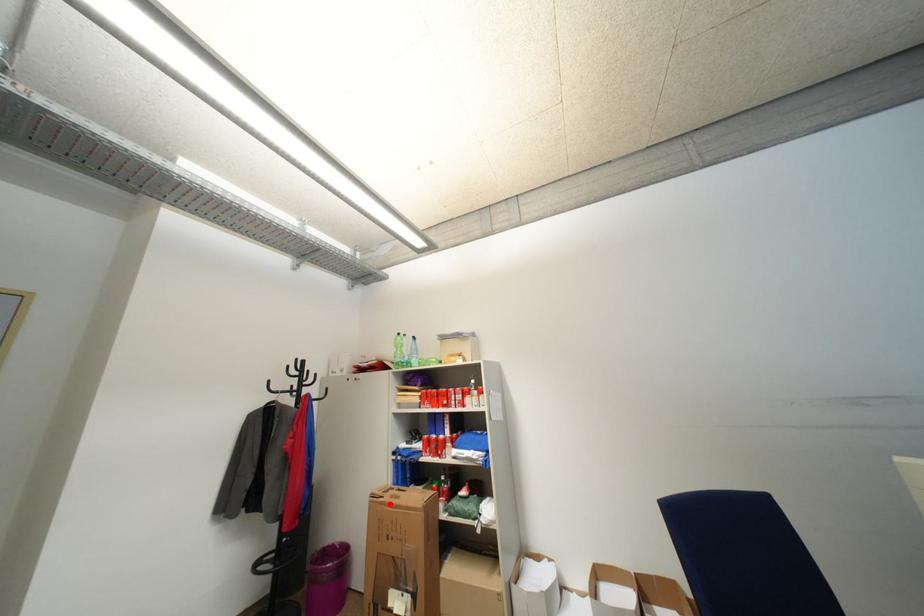
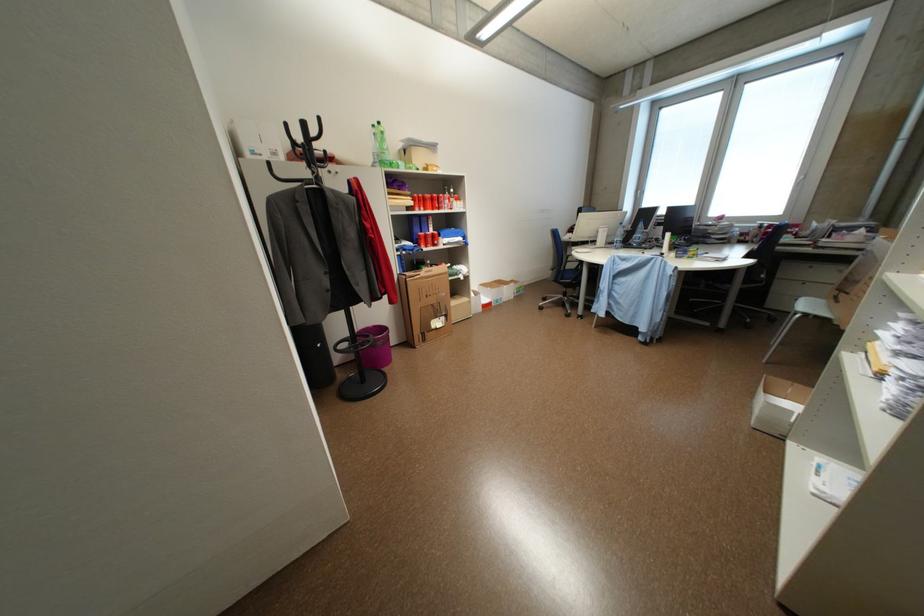
Question: A red point is marked in image1. In image2, is the corresponding 3D point closer to the camera or farther? Reply with the corresponding letter.

Choices:
 (A) The corresponding 3D point is closer.
 (B) The corresponding 3D point is farther.

Answer: (A)